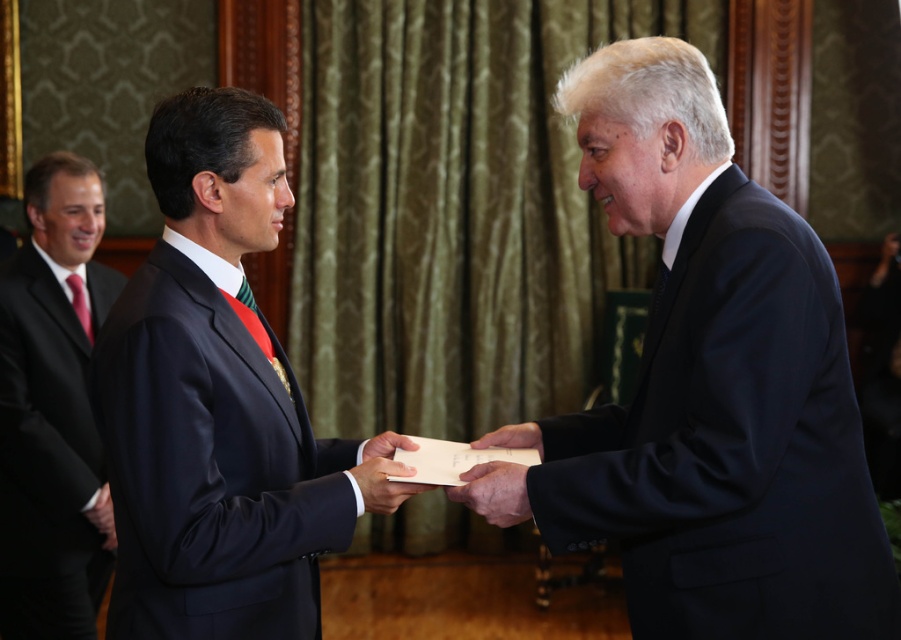
Can you confirm if black matte suit at center is bigger than red silk tie at left?

Yes, black matte suit at center is bigger than red silk tie at left.

Between black matte suit at center and red silk tie at left, which one is positioned higher?

red silk tie at left is above.

Which is behind, point (842, 538) or point (80, 321)?

The point (80, 321) is more distant.

Locate an element on the screen. The width and height of the screenshot is (901, 640). black matte suit at center is located at coordinates (715, 385).

Does point (768, 195) lie behind point (97, 609)?

No, it is not.

Does point (654, 38) come behind point (41, 520)?

No, it is not.

Where is `black matte suit at center`? This screenshot has width=901, height=640. black matte suit at center is located at coordinates point(715,385).

Does black matte suit at center appear on the left side of matte black folder at center?

No, black matte suit at center is not to the left of matte black folder at center.

Where is `black matte suit at center`? The image size is (901, 640). black matte suit at center is located at coordinates (715, 385).